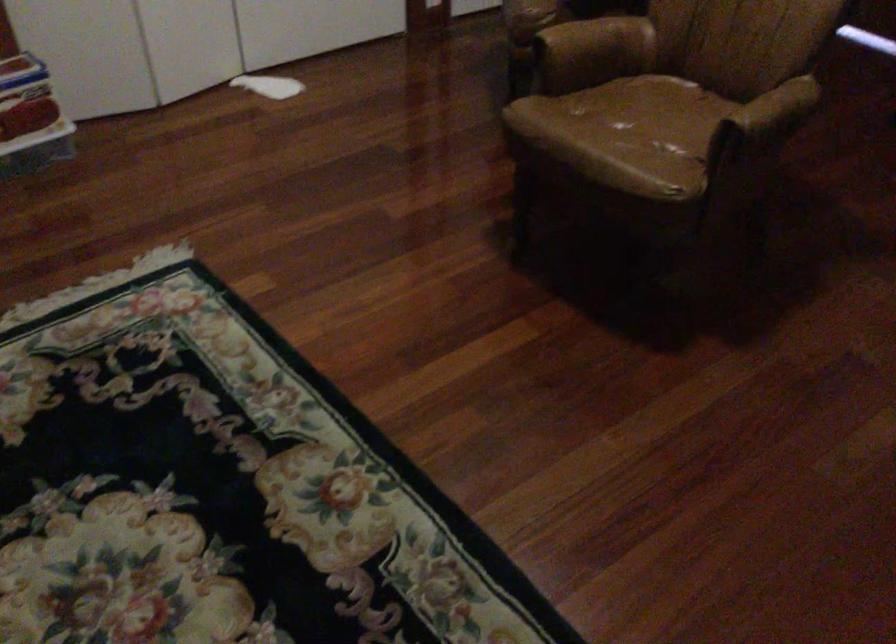
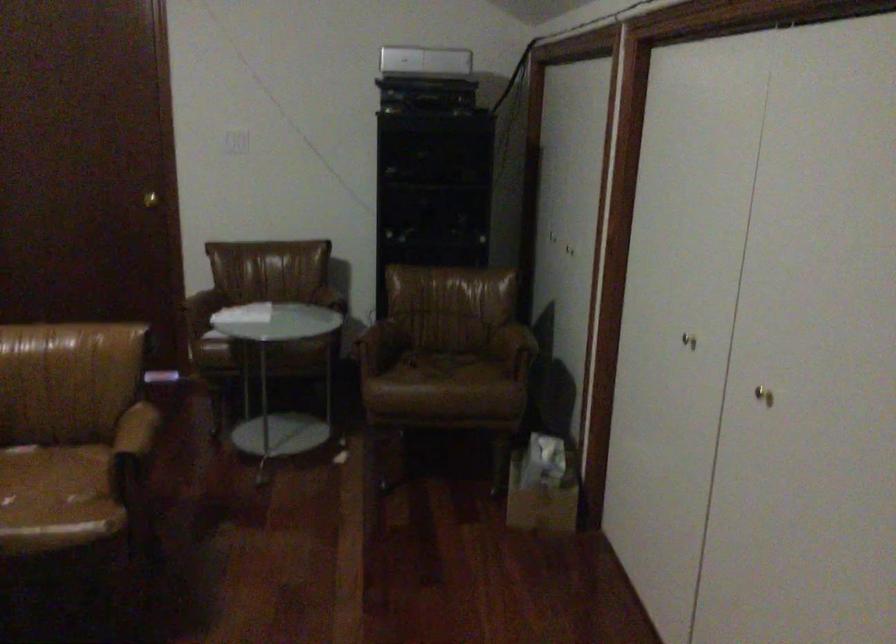
Question: The images are taken continuously from a first-person perspective. In which direction is your viewpoint rotating?

Choices:
 (A) Left
 (B) Right
 (C) Up
 (D) Down

Answer: (B)